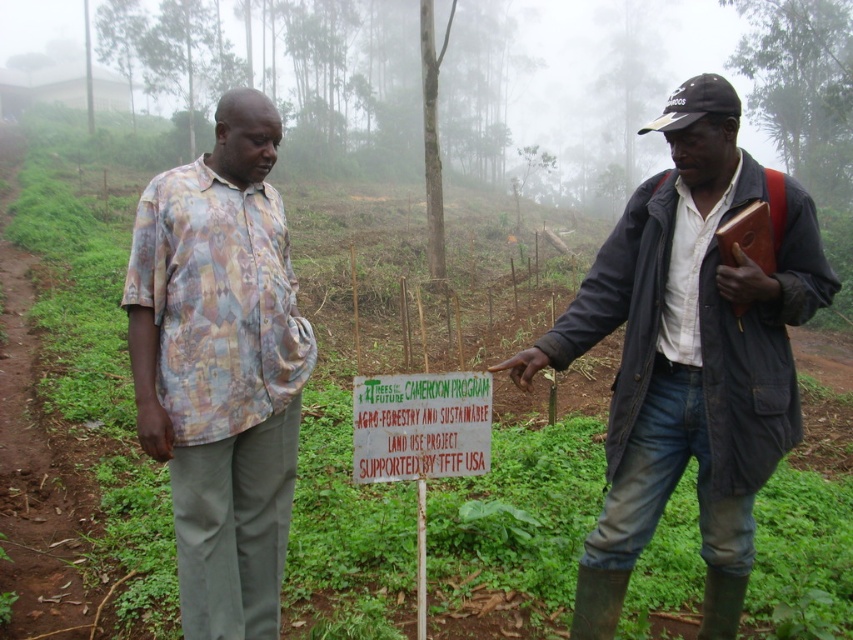
Consider the image. You are standing at the point marked as point (689, 355) in the image. Which object is directly in front of you?

The point (689, 355) corresponds to the dark blue jacket at center, so the dark blue jacket at center is directly in front of you.

You are a delivery person who needs to place a package on the green wooden sign at center. Your delivery robot has a 50 cm arm. Can it reach the sign from the dark blue jacket at center?

The dark blue jacket at center is 52.27 centimeters away from the green wooden sign at center. Since the robot arm is only 50 cm, it cannot reach the sign from the jacket.